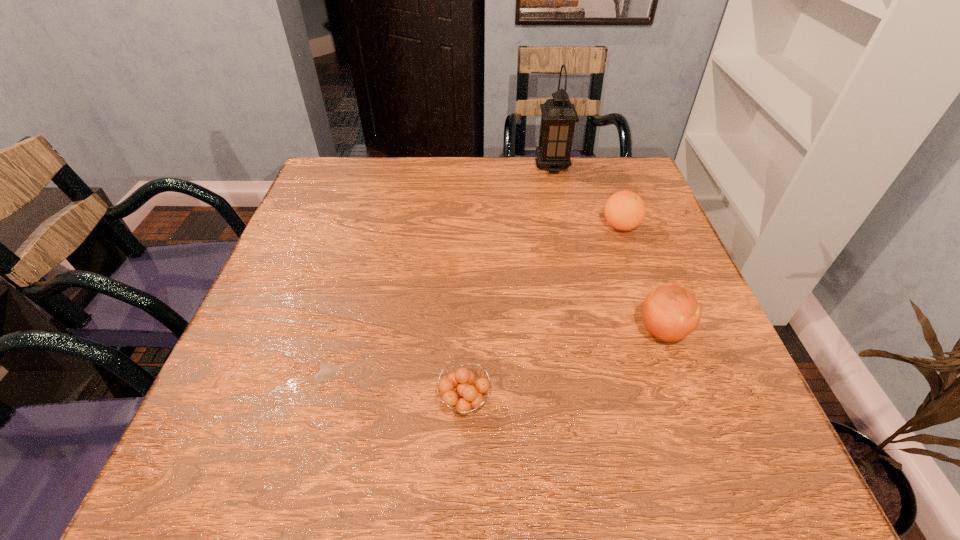
Find the location of a particular element. Image resolution: width=960 pixels, height=540 pixels. the farthest object is located at coordinates (559, 116).

Locate an element on the screen. This screenshot has width=960, height=540. the second object from left to right is located at coordinates (559, 116).

Where is `the tallest orange fruit`? Image resolution: width=960 pixels, height=540 pixels. the tallest orange fruit is located at coordinates (670, 313).

Where is `the third shortest object`? This screenshot has width=960, height=540. the third shortest object is located at coordinates pyautogui.click(x=670, y=313).

You are a GUI agent. You are given a task and a screenshot of the screen. Output one action in this format:
    pyautogui.click(x=<x>, y=<y>)
    Task: Click on the second shortest object
    
    Given the screenshot: What is the action you would take?
    pyautogui.click(x=625, y=210)

This screenshot has height=540, width=960. I want to click on the farthest orange fruit, so click(x=625, y=210).

Find the location of a particular element. This screenshot has width=960, height=540. the shortest object is located at coordinates (458, 388).

I want to click on the nearest orange fruit, so click(x=458, y=388).

The image size is (960, 540). Find the location of `free space located 0.360m on the front of the farthest object`. free space located 0.360m on the front of the farthest object is located at coordinates (573, 263).

I want to click on vacant space located on the back of the third farthest object, so click(630, 241).